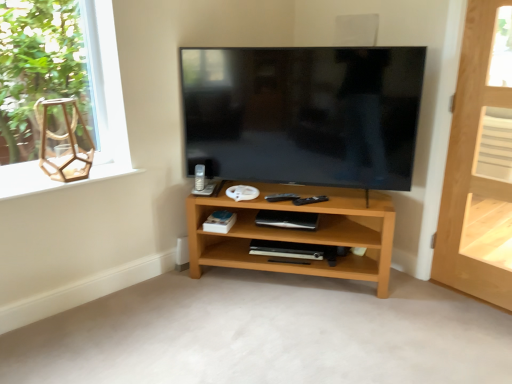
You are a GUI agent. You are given a task and a screenshot of the screen. Output one action in this format:
    pyautogui.click(x=<x>, y=<y>)
    Task: Click on the white matte speaker at upper center
    
    Given the screenshot: What is the action you would take?
    pyautogui.click(x=356, y=30)

Consider the image. Is the surface of wooden frame at left in direct contact with light brown wooden door at right?

No, wooden frame at left is not beside light brown wooden door at right.

Would you say wooden frame at left is inside or outside light brown wooden door at right?

wooden frame at left cannot be found inside light brown wooden door at right.

Does wooden frame at left have a lesser height compared to light brown wooden door at right?

Yes.

Considering the points (110, 86) and (470, 23), which point is behind, point (110, 86) or point (470, 23)?

The point (110, 86) is farther.

In the scene shown: Is matte black tv at center further to the viewer compared to light brown wood shelf at center, which is the 1th shelf in bottom-to-top order?

That is False.

Which of these two, matte black tv at center or light brown wood shelf at center, which ranks as the 2th shelf in right-to-left order, stands taller?

matte black tv at center.

Is matte black tv at center positioned with its back to light brown wood shelf at center, acting as the first shelf starting from the front?

That's not correct — matte black tv at center is not looking away from light brown wood shelf at center, acting as the first shelf starting from the front.

Which is more to the left, matte black tv at center or light brown wood shelf at center, marked as the first shelf in a left-to-right arrangement?

Positioned to the left is light brown wood shelf at center, marked as the first shelf in a left-to-right arrangement.

How much distance is there between light brown wooden door at right and wooden hexagon at upper left?

6.19 feet.

Is light brown wooden door at right not near wooden hexagon at upper left?

Yes, light brown wooden door at right and wooden hexagon at upper left are located far from each other.

Locate an element on the screen. The image size is (512, 384). door above the wooden hexagon at upper left (from a real-world perspective) is located at coordinates (476, 173).

Is point (474, 91) closer to viewer compared to point (99, 158)?

Yes.

Are matte black tv at center and wooden hexagon at upper left making contact?

No, matte black tv at center is not in contact with wooden hexagon at upper left.

Consider the image. From the image's perspective, is matte black tv at center on top of wooden hexagon at upper left?

Yes, from the image's perspective, matte black tv at center is on top of wooden hexagon at upper left.

Is matte black tv at center at the left side of wooden hexagon at upper left?

Incorrect, matte black tv at center is not on the left side of wooden hexagon at upper left.

What's the angular difference between matte black tv at center and wooden hexagon at upper left's facing directions?

There is a 53.5-degree angle between the facing directions of matte black tv at center and wooden hexagon at upper left.

Which is in front, point (466, 277) or point (199, 64)?

The point (466, 277) is closer.

Is light brown wooden door at right closer to the viewer compared to matte black tv at center?

Yes, the depth of light brown wooden door at right is less than that of matte black tv at center.

Can you tell me how much light brown wooden door at right and matte black tv at center differ in facing direction?

The angular difference between light brown wooden door at right and matte black tv at center is 37.3 degrees.

Which is more to the right, light brown wooden door at right or matte black tv at center?

light brown wooden door at right is more to the right.

Is the position of light brown wood shelf at center, which is the second shelf from top to bottom, more distant than that of wooden frame at left?

Yes, it is behind wooden frame at left.

Can you confirm if light brown wood shelf at center, placed as the second shelf when sorted from back to front, is bigger than wooden frame at left?

Correct, light brown wood shelf at center, placed as the second shelf when sorted from back to front, is larger in size than wooden frame at left.

You are a GUI agent. You are given a task and a screenshot of the screen. Output one action in this format:
    pyautogui.click(x=<x>, y=<y>)
    Task: Click on the shelf that is the 1st one when counting backward from the wooden frame at left
    This screenshot has height=384, width=512.
    Given the screenshot: What is the action you would take?
    pyautogui.click(x=298, y=232)

Consider the image. Which of these two, light brown wood shelf at center, marked as the first shelf in a left-to-right arrangement, or wooden frame at left, is wider?

With larger width is light brown wood shelf at center, marked as the first shelf in a left-to-right arrangement.

Is white matte speaker at upper center at the back of wooden frame at left?

That's not correct — wooden frame at left is not looking away from white matte speaker at upper center.

Based on the photo, measure the distance from wooden frame at left to white matte speaker at upper center.

wooden frame at left is 1.44 meters from white matte speaker at upper center.

Considering the relative positions of wooden frame at left and white matte speaker at upper center in the image provided, is wooden frame at left to the right of white matte speaker at upper center from the viewer's perspective?

Incorrect, wooden frame at left is not on the right side of white matte speaker at upper center.

Which of these two, wooden frame at left or white matte speaker at upper center, is smaller?

With smaller size is white matte speaker at upper center.

You are a GUI agent. You are given a task and a screenshot of the screen. Output one action in this format:
    pyautogui.click(x=<x>, y=<y>)
    Task: Click on the door located on the right of wooden frame at left
    
    Given the screenshot: What is the action you would take?
    pyautogui.click(x=476, y=173)

What are the coordinates of `shelf that is the 2nd object directly below the matte black tv at center (from a real-world perspective)` in the screenshot? It's located at (298, 232).

Based on their spatial positions, is white matte speaker at upper center or light brown wood shelf at center, which is the 1th shelf in bottom-to-top order, closer to white matte shelf at right, which is counted as the 1th shelf, starting from the back?

Among the two, white matte speaker at upper center is located nearer to white matte shelf at right, which is counted as the 1th shelf, starting from the back.

Which object lies further to the anchor point wooden frame at left, light brown wood shelf at center, which is the second shelf from top to bottom, or white matte shelf at right, the second shelf positioned from the bottom?

white matte shelf at right, the second shelf positioned from the bottom, lies further to wooden frame at left than the other object.

Estimate the real-world distances between objects in this image. Which object is closer to wooden hexagon at upper left, white matte shelf at right, which appears as the 1th shelf when viewed from the top, or light brown wood shelf at center, acting as the first shelf starting from the front?

The object closer to wooden hexagon at upper left is light brown wood shelf at center, acting as the first shelf starting from the front.

Estimate the real-world distances between objects in this image. Which object is further from white matte speaker at upper center, wooden hexagon at upper left or matte black tv at center?

wooden hexagon at upper left is positioned further to the anchor white matte speaker at upper center.

From the image, which object appears to be farther from light brown wooden door at right, wooden frame at left or white matte shelf at right, the second shelf positioned from the bottom?

Based on the image, wooden frame at left appears to be further to light brown wooden door at right.

Based on their spatial positions, is light brown wooden door at right or white matte speaker at upper center closer to matte black tv at center?

The object closer to matte black tv at center is white matte speaker at upper center.

When comparing their distances from wooden frame at left, does light brown wood shelf at center, placed as the second shelf when sorted from back to front, or white matte speaker at upper center seem closer?

Among the two, light brown wood shelf at center, placed as the second shelf when sorted from back to front, is located nearer to wooden frame at left.

Considering their positions, is wooden frame at left positioned further to wooden hexagon at upper left than light brown wood shelf at center, which is the second shelf from top to bottom?

The object further to wooden hexagon at upper left is light brown wood shelf at center, which is the second shelf from top to bottom.

Locate an element on the screen. The width and height of the screenshot is (512, 384). shelf situated between wooden frame at left and light brown wooden door at right from left to right is located at coordinates (298, 232).

You are a GUI agent. You are given a task and a screenshot of the screen. Output one action in this format:
    pyautogui.click(x=<x>, y=<y>)
    Task: Click on the television between wooden hexagon at upper left and white matte shelf at right, which is counted as the 1th shelf, starting from the back, from left to right
    This screenshot has width=512, height=384.
    Given the screenshot: What is the action you would take?
    pyautogui.click(x=303, y=114)

You are a GUI agent. You are given a task and a screenshot of the screen. Output one action in this format:
    pyautogui.click(x=<x>, y=<y>)
    Task: Click on the speaker between wooden hexagon at upper left and white matte shelf at right, which is counted as the 1th shelf, starting from the back
    
    Given the screenshot: What is the action you would take?
    pyautogui.click(x=356, y=30)

You are a GUI agent. You are given a task and a screenshot of the screen. Output one action in this format:
    pyautogui.click(x=<x>, y=<y>)
    Task: Click on the door situated between wooden hexagon at upper left and white matte shelf at right, the second shelf when ordered from front to back, from left to right
    This screenshot has width=512, height=384.
    Given the screenshot: What is the action you would take?
    pyautogui.click(x=476, y=173)